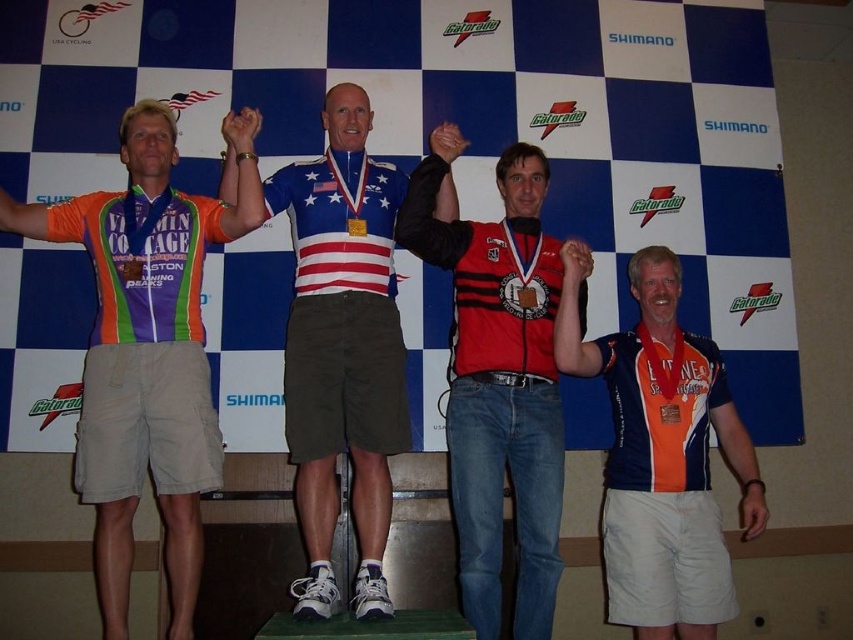
Question: Can you confirm if matte jersey at center is bigger than american flag jersey at center?

Choices:
 (A) no
 (B) yes

Answer: (A)

Question: Does american flag jersey at center have a greater width compared to red matte vest at center?

Choices:
 (A) no
 (B) yes

Answer: (B)

Question: Which object is the farthest from the matte orange jersey at right?

Choices:
 (A) red matte vest at center
 (B) matte jersey at center
 (C) american flag jersey at center

Answer: (B)

Question: Which object appears closest to the camera in this image?

Choices:
 (A) matte jersey at center
 (B) american flag jersey at center
 (C) matte orange jersey at right
 (D) red matte vest at center

Answer: (B)

Question: Which point is closer to the camera?

Choices:
 (A) matte orange jersey at right
 (B) american flag jersey at center
 (C) red matte vest at center

Answer: (B)

Question: Is american flag jersey at center closer to camera compared to matte orange jersey at right?

Choices:
 (A) no
 (B) yes

Answer: (B)